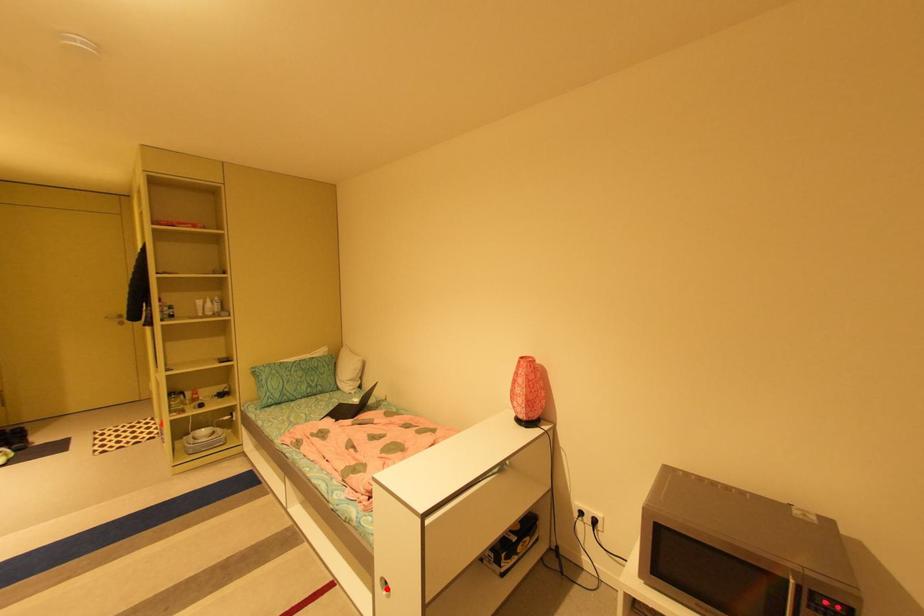
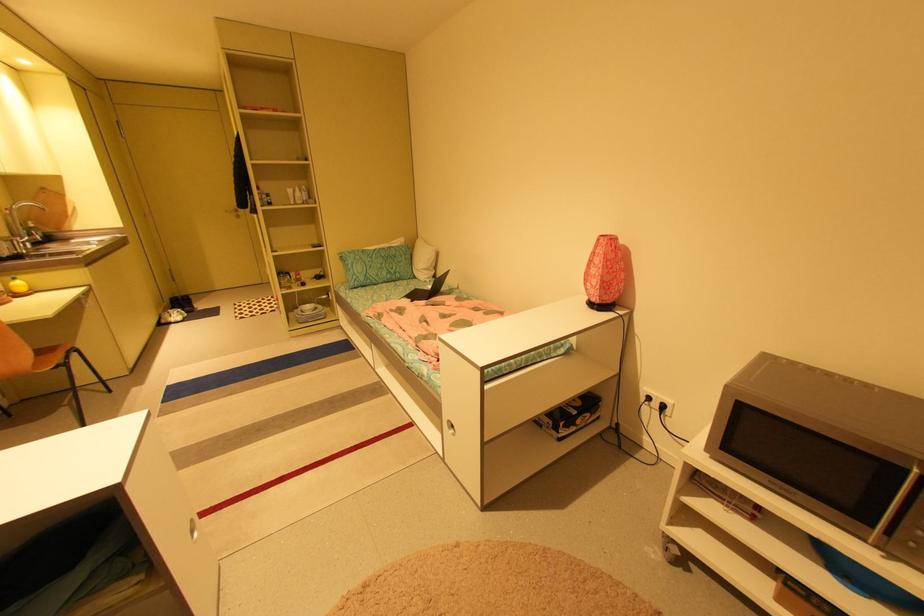
The point at the highlighted location is marked in the first image. Where is the corresponding point in the second image?

(454, 429)